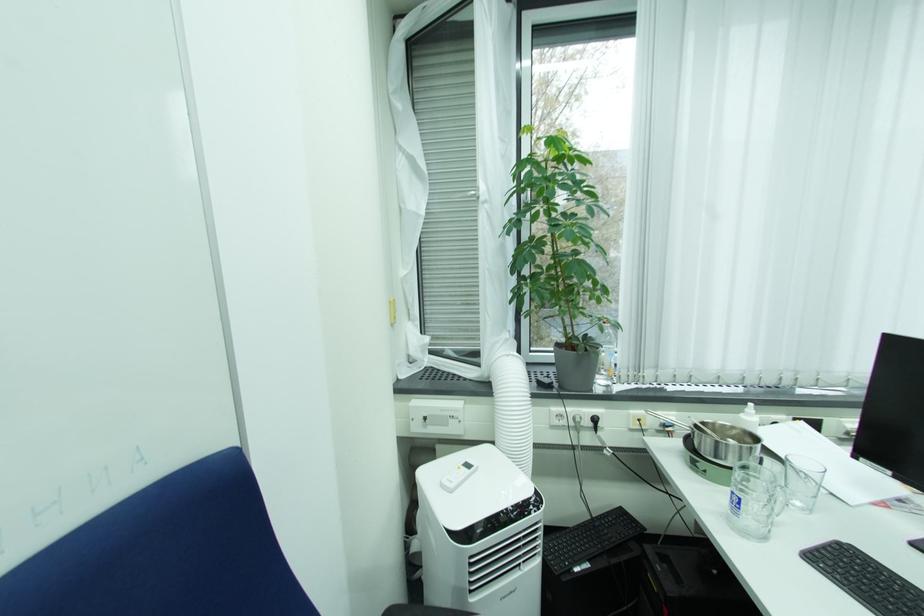
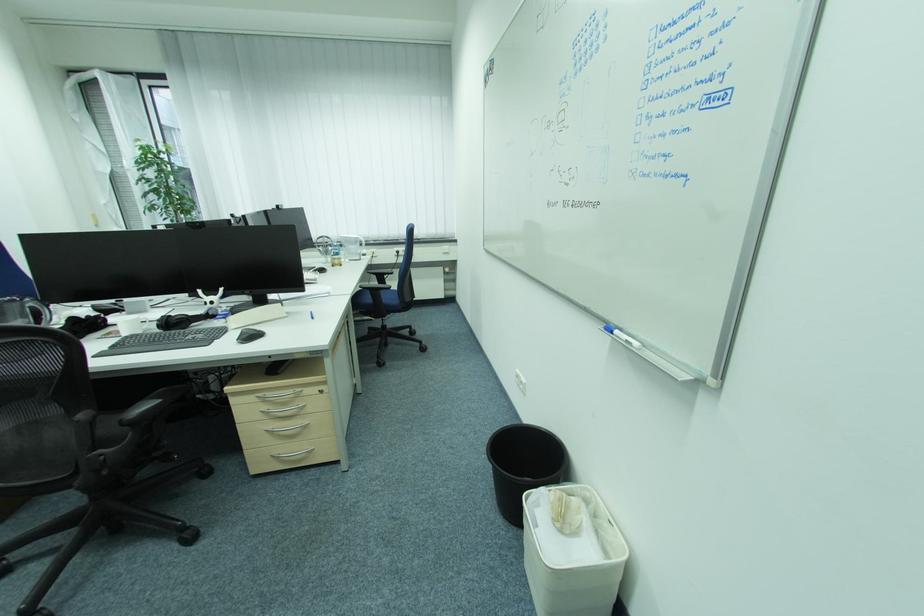
In a continuous first-person perspective shot, in which direction is the camera moving?

The cameraman moved toward right, backward.